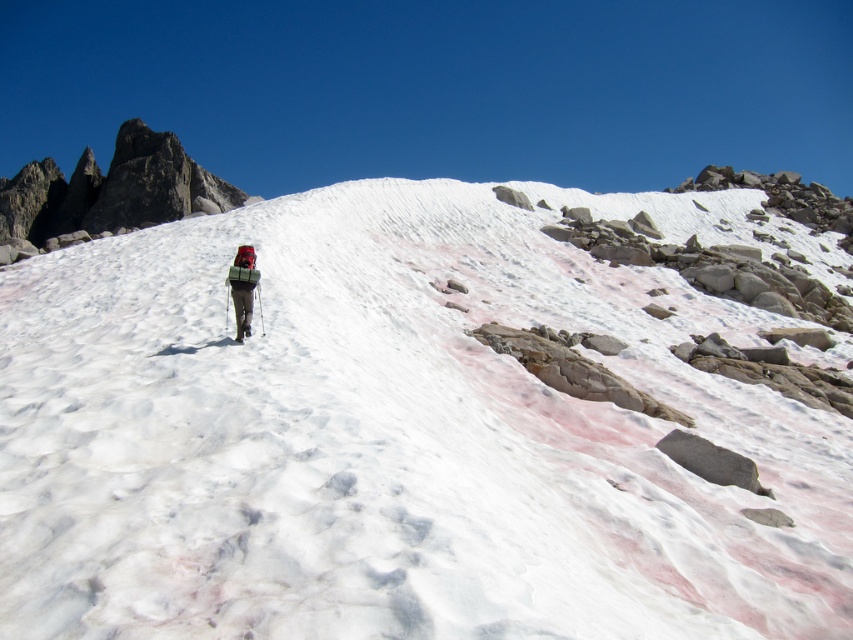
Question: Which of the following is the farthest from the observer?

Choices:
 (A) green fabric backpack at center
 (B) white powdery snow at center

Answer: (A)

Question: Is the position of white powdery snow at center more distant than that of green fabric backpack at center?

Choices:
 (A) no
 (B) yes

Answer: (A)

Question: Which of the following is the closest to the observer?

Choices:
 (A) (250, 307)
 (B) (563, 252)

Answer: (A)

Question: Does white powdery snow at center have a greater width compared to green fabric backpack at center?

Choices:
 (A) yes
 (B) no

Answer: (A)

Question: Observing the image, what is the correct spatial positioning of white powdery snow at center in reference to green fabric backpack at center?

Choices:
 (A) right
 (B) left

Answer: (A)